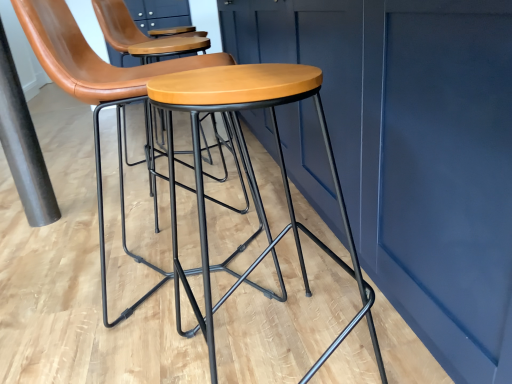
Question: Is matte brown leather stool at center taller or shorter than black matte pole at left?

Choices:
 (A) short
 (B) tall

Answer: (B)

Question: From a real-world perspective, is matte brown leather stool at center above or below black matte pole at left?

Choices:
 (A) above
 (B) below

Answer: (A)

Question: Which object is the closest to the black matte pole at left?

Choices:
 (A) matte brown leather stool at center
 (B) matte wood stool at center

Answer: (A)

Question: Estimate the real-world distances between objects in this image. Which object is closer to the matte brown leather stool at center?

Choices:
 (A) black matte pole at left
 (B) matte wood stool at center

Answer: (B)